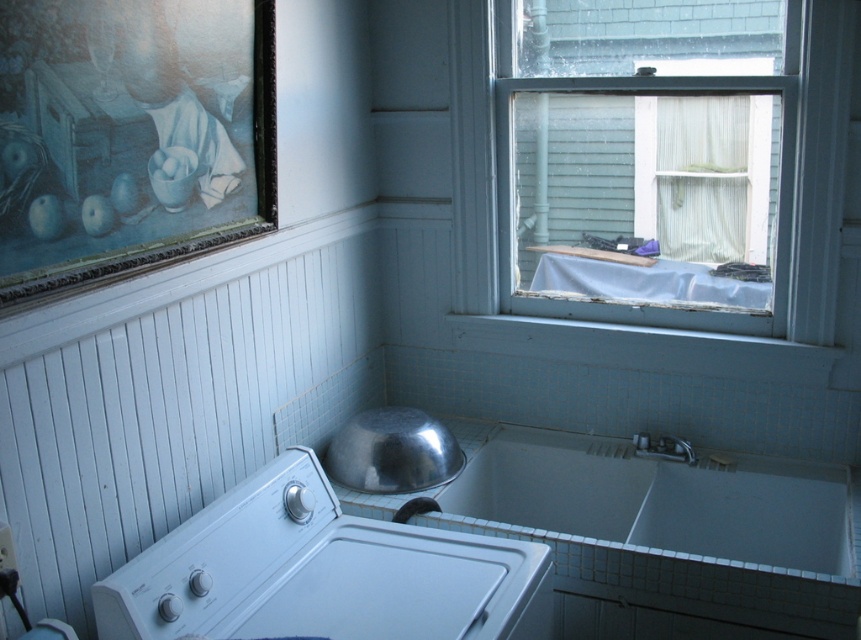
You are standing in the utility room and want to see outside through the clear glass window at upper right. However, there is a white plastic washer at lower left in the way. Can you move the washer to the side to get a better view?

The clear glass window at upper right is taller than the white plastic washer at lower left, so moving the washer aside would allow you to see through the window without obstruction.

You are standing in the utility room and need to reach the clear glass window at upper right to open it for ventilation. Can you estimate whether you can reach it without using a stool?

The clear glass window at upper right is 1.87 meters away from you. Since the distance is horizontal, and assuming an average person can reach about 2 meters horizontally, you can likely reach it without needing a stool.

You are standing in the utility room and need to locate the white plastic washer at lower left and the clear glass window at upper right. Which object is positioned to the right side of the other?

The clear glass window at upper right is to the right of the white plastic washer at lower left.